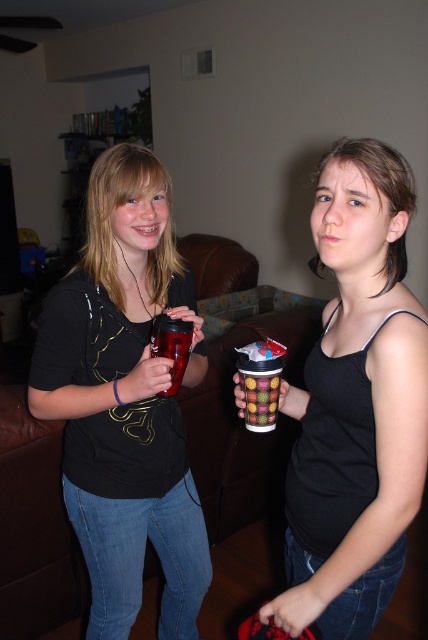
Based on the photo, does matte plastic cup at center have a greater width compared to matte black tank top at center?

Yes, matte plastic cup at center is wider than matte black tank top at center.

Between matte plastic cup at center and matte black tank top at center, which one has less height?

matte black tank top at center

Is point (89, 195) more distant than point (369, 317)?

Yes.

The height and width of the screenshot is (640, 428). I want to click on matte plastic cup at center, so click(x=124, y=400).

Which is above, matte black tank top at center or multicolored plastic cup at center?

Positioned higher is matte black tank top at center.

Can you confirm if matte black tank top at center is wider than multicolored plastic cup at center?

Yes, matte black tank top at center is wider than multicolored plastic cup at center.

Which is in front, point (344, 401) or point (252, 404)?

Point (344, 401) is in front.

Where is `matte black tank top at center`? The image size is (428, 640). matte black tank top at center is located at coordinates (356, 403).

How much distance is there between matte plastic cup at center and multicolored plastic cup at center?

15.92 inches

Who is higher up, matte plastic cup at center or multicolored plastic cup at center?

multicolored plastic cup at center

Where is `matte plastic cup at center`? This screenshot has width=428, height=640. matte plastic cup at center is located at coordinates (124, 400).